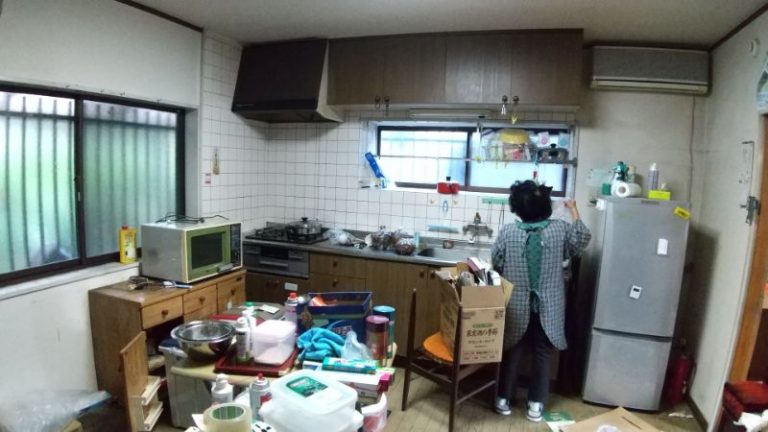
Locate an element on the screen. This screenshot has width=768, height=432. microwave is located at coordinates (200, 245).